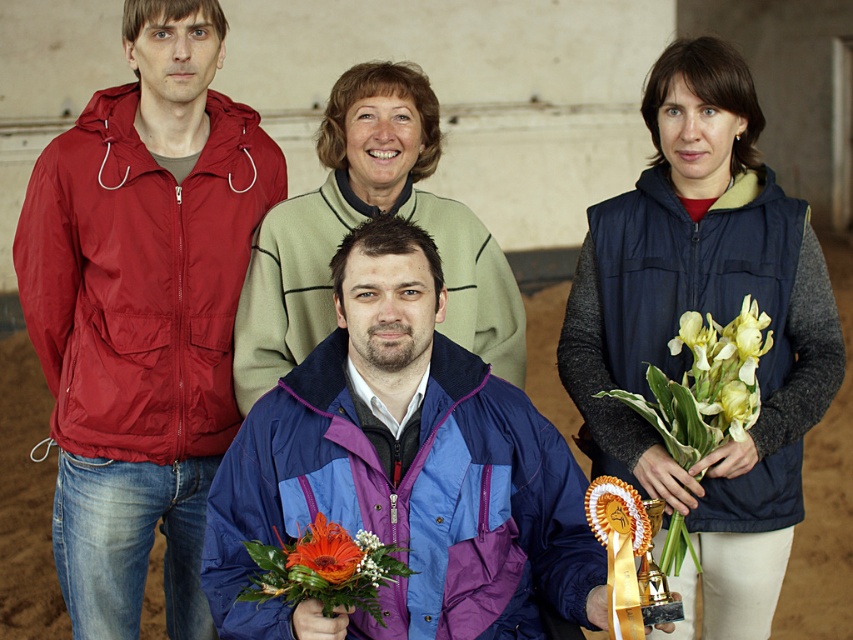
You are a photographer setting up for a group photo. You have two items in the foreground, an orange flower bouquet at center and an orange silk ribbon at center. Which item should you focus on if you want to highlight the larger object?

The orange flower bouquet at center is bigger than the orange silk ribbon at center, so you should focus on the orange flower bouquet at center to highlight the larger object.